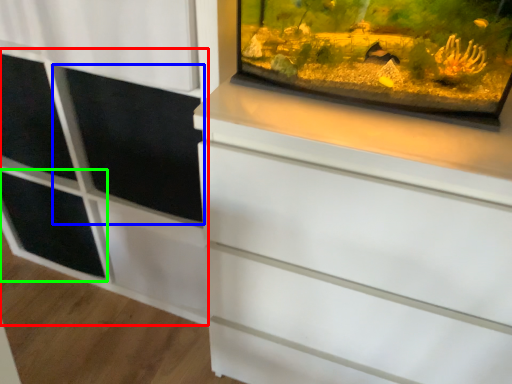
Question: Considering the real-world distances, which object is closest to side cabinet (highlighted by a red box)? screen door (highlighted by a blue box) or shelf (highlighted by a green box).

Choices:
 (A) screen door
 (B) shelf

Answer: (A)